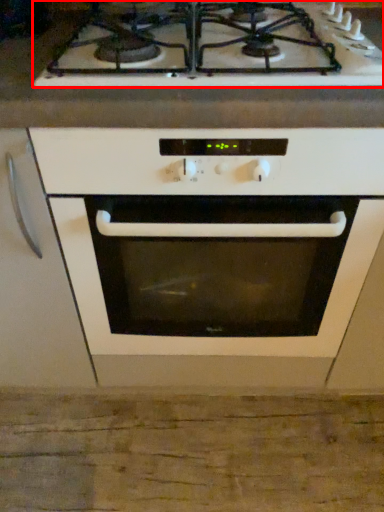
Question: In this image, where is gas stove (annotated by the red box) located relative to oven?

Choices:
 (A) left
 (B) right

Answer: (A)